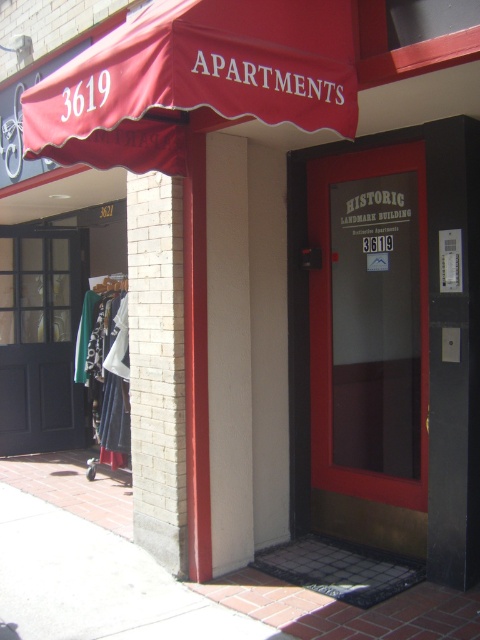
You are a delivery person trying to enter the building. The address on your package is 3619. Which door should you use based on the height difference between the matte glass door at center and the matte black door at left?

The matte glass door at center is taller than the matte black door at left. Since the address 3619 is displayed on the red awning above the doorway and written on the glass door, you should use the matte glass door at center to enter the building.

You are a delivery person trying to enter the building at 3619 Apartments. You see a matte glass door at center and a matte black door at left. Which door is above the other?

The matte glass door at center is positioned over the matte black door at left.